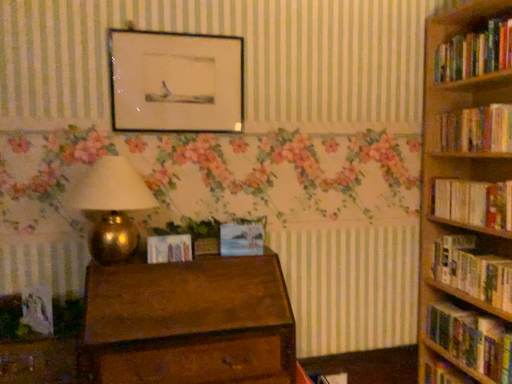
Question: From a real-world perspective, is hardcover book at right, marked as the 4th book in a top-to-bottom arrangement, physically below wooden drawer at lower left?

Choices:
 (A) yes
 (B) no

Answer: (B)

Question: From a real-world perspective, does hardcover book at right, which appears as the second book when ordered from the bottom, stand above wooden drawer at lower left?

Choices:
 (A) yes
 (B) no

Answer: (A)

Question: From the image's perspective, does hardcover book at right, marked as the 4th book in a top-to-bottom arrangement, appear lower than wooden drawer at lower left?

Choices:
 (A) yes
 (B) no

Answer: (B)

Question: Is hardcover book at right, marked as the 4th book in a top-to-bottom arrangement, positioned far away from wooden drawer at lower left?

Choices:
 (A) no
 (B) yes

Answer: (B)

Question: Can you confirm if hardcover book at right, which appears as the second book when ordered from the bottom, is smaller than wooden drawer at lower left?

Choices:
 (A) no
 (B) yes

Answer: (B)

Question: Can you confirm if hardcover book at right, which appears as the second book when ordered from the bottom, is shorter than wooden drawer at lower left?

Choices:
 (A) no
 (B) yes

Answer: (B)

Question: Considering the relative positions of wooden drawer at lower left and hardcover books at right, which ranks as the 2th book in top-to-bottom order, in the image provided, is wooden drawer at lower left to the right of hardcover books at right, which ranks as the 2th book in top-to-bottom order, from the viewer's perspective?

Choices:
 (A) yes
 (B) no

Answer: (B)

Question: Is wooden drawer at lower left positioned with its back to hardcover books at right, which ranks as the 4th book in bottom-to-top order?

Choices:
 (A) yes
 (B) no

Answer: (B)

Question: Does wooden drawer at lower left have a smaller size compared to hardcover books at right, which ranks as the 2th book in top-to-bottom order?

Choices:
 (A) no
 (B) yes

Answer: (A)

Question: Can you confirm if wooden drawer at lower left is shorter than hardcover books at right, which ranks as the 4th book in bottom-to-top order?

Choices:
 (A) no
 (B) yes

Answer: (A)

Question: Would you say wooden drawer at lower left is outside hardcover books at right, which ranks as the 2th book in top-to-bottom order?

Choices:
 (A) yes
 (B) no

Answer: (A)

Question: Considering the relative sizes of wooden drawer at lower left and hardcover books at right, which ranks as the 4th book in bottom-to-top order, in the image provided, is wooden drawer at lower left wider than hardcover books at right, which ranks as the 4th book in bottom-to-top order,?

Choices:
 (A) yes
 (B) no

Answer: (A)

Question: From the image's perspective, is hardcover book at right, positioned as the 3th book in top-to-bottom order, under wooden drawer at lower left?

Choices:
 (A) no
 (B) yes

Answer: (A)